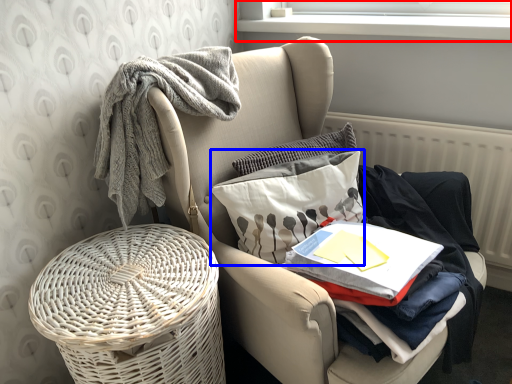
Question: Which object is further to the camera taking this photo, window screen (highlighted by a red box) or throw pillow (highlighted by a blue box)?

Choices:
 (A) window screen
 (B) throw pillow

Answer: (A)